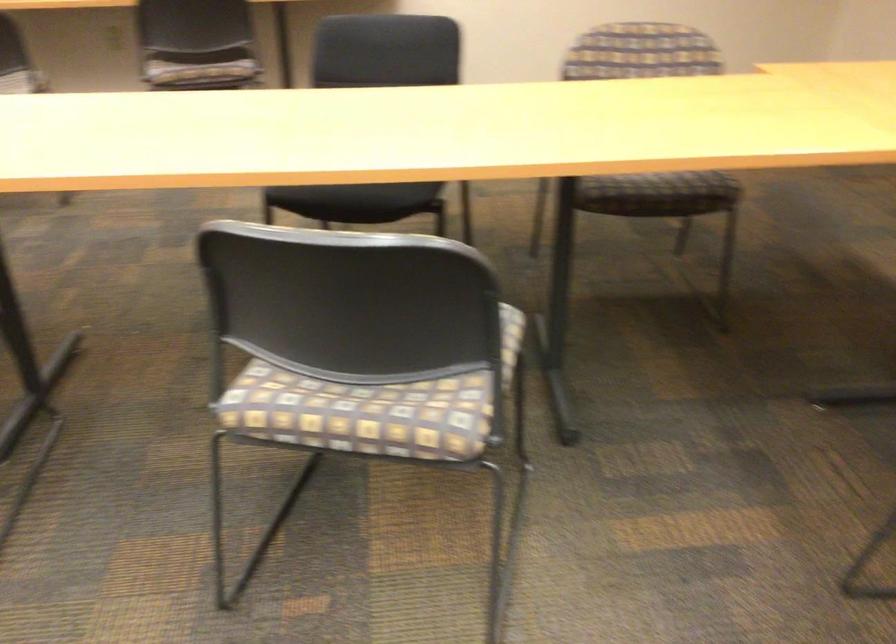
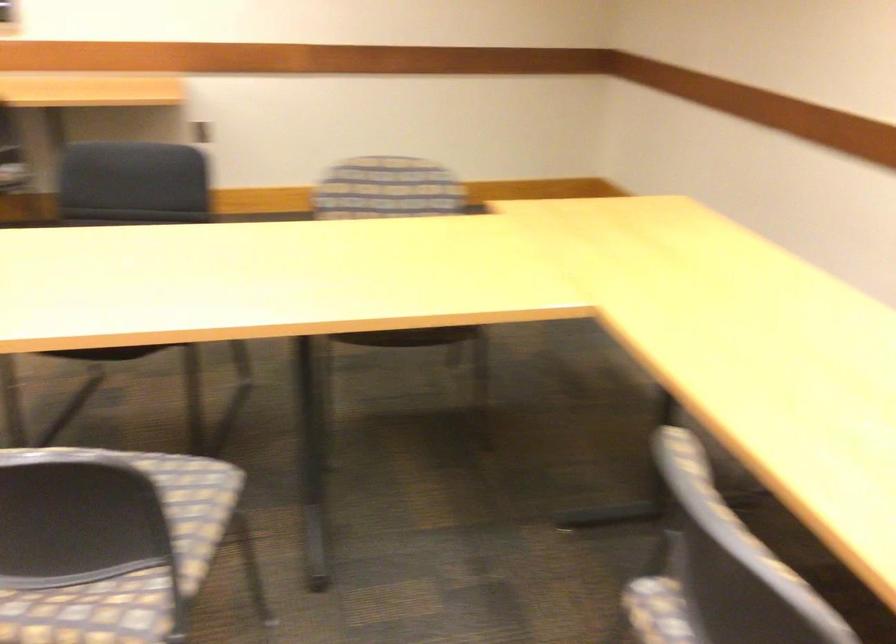
Locate, in the second image, the point that corresponds to (x=661, y=203) in the first image.

(410, 337)